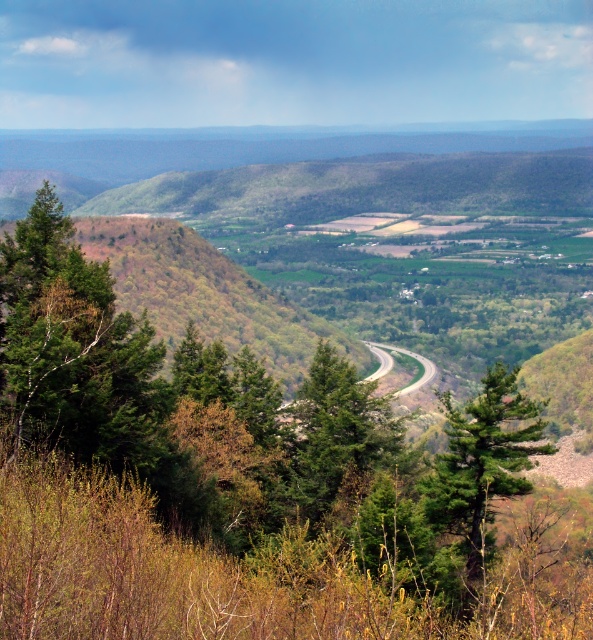
Is green matte tree at center above green textured tree at center?

No.

Is point (431, 502) more distant than point (315, 388)?

No, (431, 502) is in front of (315, 388).

Find the location of `green matte tree at center`. green matte tree at center is located at coordinates (480, 461).

Does green leafy tree at center appear over green matte tree at center?

Correct, green leafy tree at center is located above green matte tree at center.

Which of these two, green leafy tree at center or green matte tree at center, stands taller?

Standing taller between the two is green leafy tree at center.

The width and height of the screenshot is (593, 640). What do you see at coordinates (250, 484) in the screenshot?
I see `green leafy tree at center` at bounding box center [250, 484].

Where is `green leafy tree at center`? The image size is (593, 640). green leafy tree at center is located at coordinates (250, 484).

Is point (329, 600) behind point (390, 432)?

That is False.

Is point (42, 612) closer to viewer compared to point (310, 464)?

Yes, point (42, 612) is closer to viewer.

Identify the location of green leafy tree at center. (250, 484).